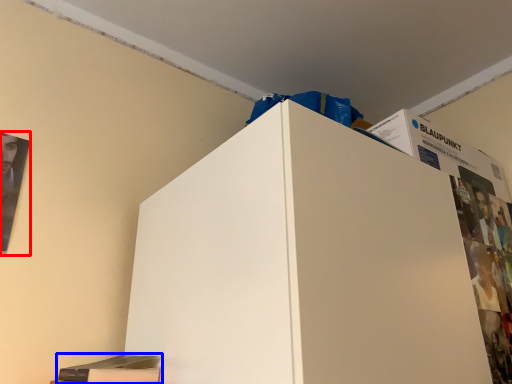
Question: Which object is closer to the camera taking this photo, poster page (highlighted by a red box) or magazine (highlighted by a blue box)?

Choices:
 (A) poster page
 (B) magazine

Answer: (B)